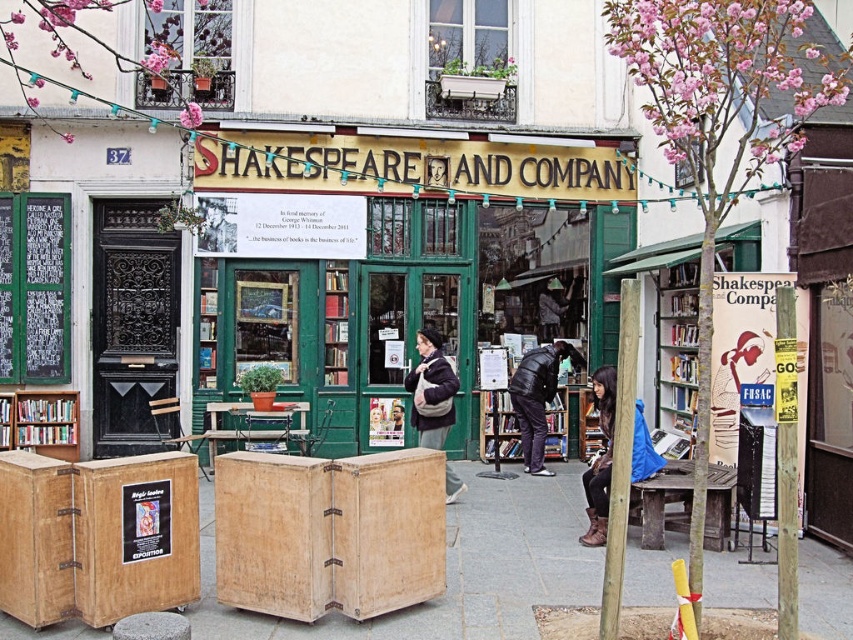
Between wooden crates at center and black puffy jacket at center, which one appears on the right side from the viewer's perspective?

From the viewer's perspective, black puffy jacket at center appears more on the right side.

Is wooden crates at center wider than black puffy jacket at center?

Yes, wooden crates at center is wider than black puffy jacket at center.

Identify the location of wooden crates at center. The image size is (853, 640). (454, 570).

Who is shorter, green wooden bookstore at center or black puffy jacket at center?

black puffy jacket at center is shorter.

Who is more forward, (521, 212) or (529, 372)?

Point (529, 372) is more forward.

Find the location of a particular element. This screenshot has width=853, height=640. green wooden bookstore at center is located at coordinates (402, 266).

Is leather boots at lower right taller than matte black coat at center?

Yes, leather boots at lower right is taller than matte black coat at center.

Is leather boots at lower right smaller than matte black coat at center?

No, leather boots at lower right is not smaller than matte black coat at center.

Does point (646, 433) lie in front of point (421, 371)?

Yes, it is in front of point (421, 371).

Where is `leather boots at lower right`? leather boots at lower right is located at coordinates (601, 458).